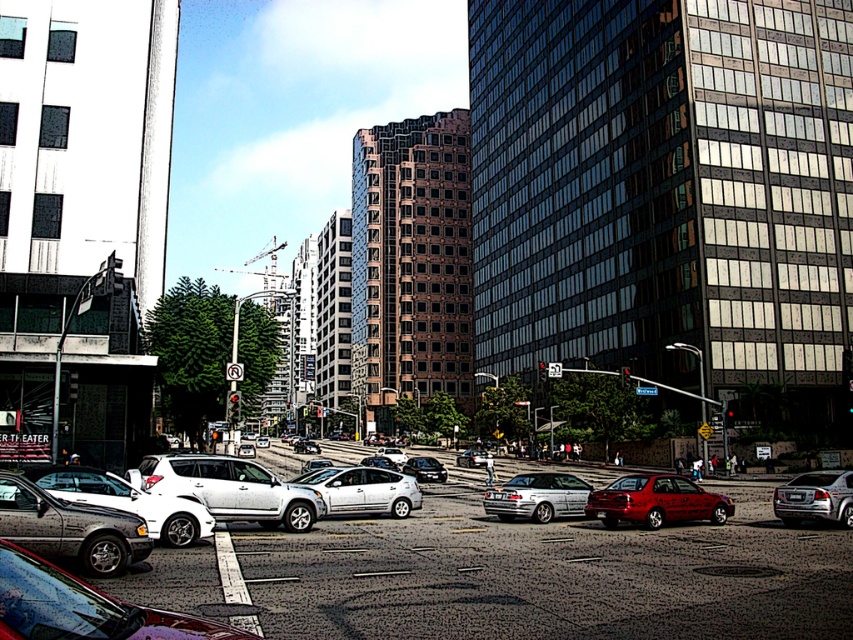
You are a pedestrian waiting at the crosswalk in the middle of the street. You see the white matte suv at center and the shiny silver sedan at center. Which vehicle is closer to you?

The white matte suv at center is closer to you because it is in front of the shiny silver sedan at center.

You are a delivery person needing to pass between the satin silver sedan at center and the metallic silver sedan at center. The delivery cart you are using is 1.2 meters wide. Can you safely navigate through the gap between them?

The gap between the satin silver sedan at center and the metallic silver sedan at center is 12.15 meters, which is significantly wider than the 1.2 meter width of the delivery cart. Therefore, you can safely navigate through the gap between them.

You are a pedestrian standing at the crosswalk. You see the shiny black sedan at center and the silver metallic sedan at lower left. Which car is closer to the right side of the road?

The shiny black sedan at center is closer to the right side of the road because it is positioned to the right of the silver metallic sedan at lower left.